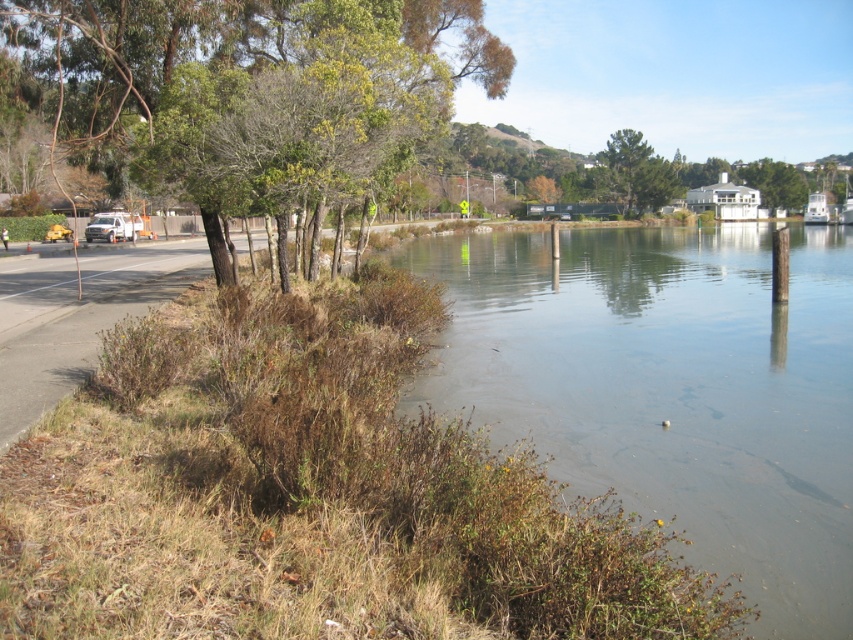
Question: Which point appears closest to the camera in this image?

Choices:
 (A) (125, 236)
 (B) (134, 134)
 (C) (636, 506)

Answer: (C)

Question: Is green leafy tree at upper left above green matte tree at upper center?

Choices:
 (A) no
 (B) yes

Answer: (A)

Question: Considering the relative positions of green leafy tree at upper left and green matte tree at upper center in the image provided, where is green leafy tree at upper left located with respect to green matte tree at upper center?

Choices:
 (A) above
 (B) below

Answer: (B)

Question: Which of these objects is positioned closest to the white matte van at left?

Choices:
 (A) brown grassy river at lower left
 (B) green leafy tree at upper left
 (C) green matte tree at upper center

Answer: (A)

Question: Does brown grassy river at lower left have a larger size compared to green matte tree at upper center?

Choices:
 (A) no
 (B) yes

Answer: (B)

Question: Among these points, which one is farthest from the camera?

Choices:
 (A) (798, 225)
 (B) (93, 227)
 (C) (611, 184)
 (D) (432, 106)

Answer: (A)